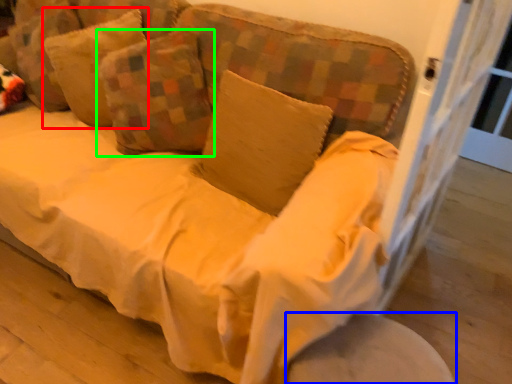
Question: Based on their relative distances, which object is farther from pillow (highlighted by a red box)? Choose from round table (highlighted by a blue box) and pillow (highlighted by a green box).

Choices:
 (A) round table
 (B) pillow

Answer: (A)